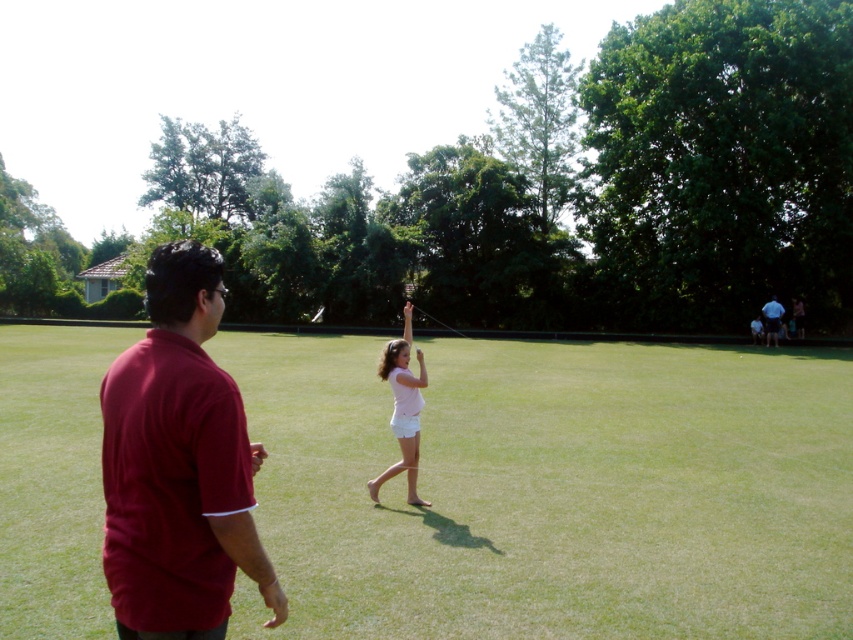
Question: Which object is closer to the camera taking this photo?

Choices:
 (A) smooth green grass at center
 (B) blue denim shorts at right
 (C) maroon cotton shirt at left

Answer: (C)

Question: Can you confirm if smooth green grass at center is wider than maroon cotton shirt at left?

Choices:
 (A) no
 (B) yes

Answer: (B)

Question: Is smooth green grass at center to the left of pink cotton shorts at center from the viewer's perspective?

Choices:
 (A) yes
 (B) no

Answer: (B)

Question: Does smooth green grass at center appear on the left side of blue denim shorts at right?

Choices:
 (A) no
 (B) yes

Answer: (B)

Question: Which point is closer to the camera?

Choices:
 (A) (422, 364)
 (B) (683, 630)
 (C) (138, 451)
 (D) (759, 314)

Answer: (C)

Question: Among these objects, which one is farthest from the camera?

Choices:
 (A) smooth green grass at center
 (B) maroon cotton shirt at left
 (C) light blue shirt at right
 (D) pink cotton shorts at center

Answer: (C)